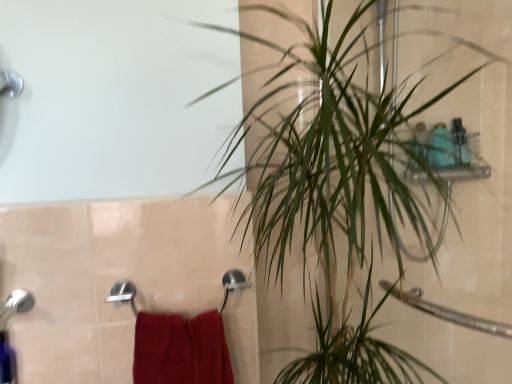
Identify the location of green leafy plant at upper right. Image resolution: width=512 pixels, height=384 pixels. (369, 172).

The height and width of the screenshot is (384, 512). What do you see at coordinates (369, 172) in the screenshot? I see `green leafy plant at upper right` at bounding box center [369, 172].

What do you see at coordinates (181, 349) in the screenshot? This screenshot has height=384, width=512. I see `red cotton towel at lower left` at bounding box center [181, 349].

This screenshot has height=384, width=512. I want to click on red cotton towel at lower left, so click(181, 349).

Measure the distance between point (164, 351) and camera.

Point (164, 351) is 98.30 centimeters from camera.

Where is `green leafy plant at upper right`? green leafy plant at upper right is located at coordinates [x=369, y=172].

Which is more to the left, green leafy plant at upper right or red cotton towel at lower left?

From the viewer's perspective, red cotton towel at lower left appears more on the left side.

Between green leafy plant at upper right and red cotton towel at lower left, which one is positioned in front?

Positioned in front is green leafy plant at upper right.

Does point (439, 253) lie behind point (144, 381)?

Yes.

From the image's perspective, relative to red cotton towel at lower left, is green leafy plant at upper right above or below?

green leafy plant at upper right is situated higher than red cotton towel at lower left in the image.

In the scene shown: From a real-world perspective, between green leafy plant at upper right and red cotton towel at lower left, who is vertically higher?

green leafy plant at upper right is physically above.

Considering the sizes of objects green leafy plant at upper right and red cotton towel at lower left in the image provided, who is wider, green leafy plant at upper right or red cotton towel at lower left?

With larger width is green leafy plant at upper right.

Is green leafy plant at upper right taller than red cotton towel at lower left?

Yes.

Can you confirm if green leafy plant at upper right is smaller than red cotton towel at lower left?

Actually, green leafy plant at upper right might be larger than red cotton towel at lower left.

Is green leafy plant at upper right spatially inside red cotton towel at lower left, or outside of it?

green leafy plant at upper right cannot be found inside red cotton towel at lower left.

Consider the image. Are green leafy plant at upper right and red cotton towel at lower left beside each other?

No, green leafy plant at upper right is not with red cotton towel at lower left.

Is green leafy plant at upper right positioned with its back to red cotton towel at lower left?

green leafy plant at upper right does not have its back to red cotton towel at lower left.

What's the angular difference between green leafy plant at upper right and red cotton towel at lower left's facing directions?

The angular difference between green leafy plant at upper right and red cotton towel at lower left is 0.978 degrees.

How distant is green leafy plant at upper right from red cotton towel at lower left?

green leafy plant at upper right is 23.59 inches away from red cotton towel at lower left.

The width and height of the screenshot is (512, 384). I want to click on houseplant on the right of red cotton towel at lower left, so click(x=369, y=172).

Looking at this image, considering the relative positions of red cotton towel at lower left and green leafy plant at upper right in the image provided, is red cotton towel at lower left to the right of green leafy plant at upper right from the viewer's perspective?

Incorrect, red cotton towel at lower left is not on the right side of green leafy plant at upper right.

Is the depth of red cotton towel at lower left greater than that of green leafy plant at upper right?

Yes, it is.

Which is further, [144,365] or [354,31]?

The point [354,31] is farther from the camera.

From the image's perspective, which one is positioned higher, red cotton towel at lower left or green leafy plant at upper right?

green leafy plant at upper right is shown above in the image.

From a real-world perspective, which is physically above, red cotton towel at lower left or green leafy plant at upper right?

From a 3D spatial view, green leafy plant at upper right is above.

Is red cotton towel at lower left thinner than green leafy plant at upper right?

Correct, the width of red cotton towel at lower left is less than that of green leafy plant at upper right.

Who is taller, red cotton towel at lower left or green leafy plant at upper right?

green leafy plant at upper right is taller.

Is red cotton towel at lower left smaller than green leafy plant at upper right?

Yes, red cotton towel at lower left is smaller than green leafy plant at upper right.

Would you say green leafy plant at upper right is part of red cotton towel at lower left's contents?

No, green leafy plant at upper right is not a part of red cotton towel at lower left.

Is there a large distance between red cotton towel at lower left and green leafy plant at upper right?

They are positioned close to each other.

In the scene shown: Is green leafy plant at upper right at the back of red cotton towel at lower left?

No, red cotton towel at lower left is not facing the opposite direction of green leafy plant at upper right.

How many degrees apart are the facing directions of red cotton towel at lower left and green leafy plant at upper right?

red cotton towel at lower left and green leafy plant at upper right are facing 0.978 degrees away from each other.

Identify the location of houseplant in front of the red cotton towel at lower left. Image resolution: width=512 pixels, height=384 pixels. pos(369,172).

I want to click on bath towel that appears behind the green leafy plant at upper right, so click(x=181, y=349).

In order to click on houseplant that is on the right side of red cotton towel at lower left in this screenshot , I will do `click(369, 172)`.